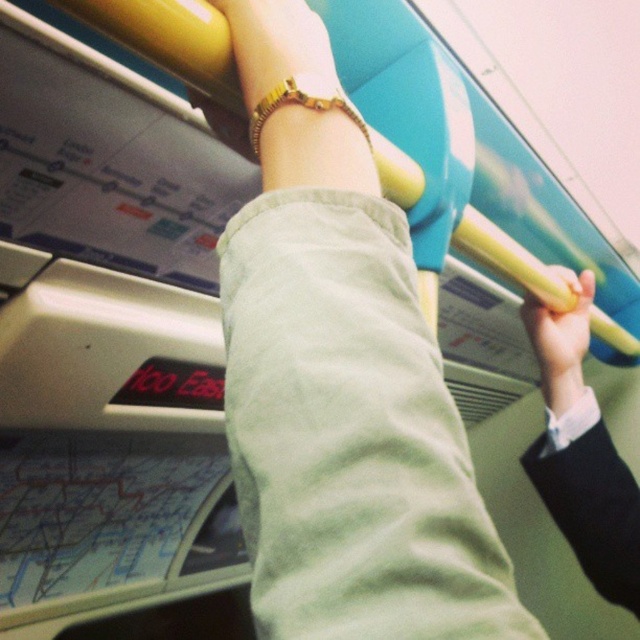
Is point (324, 40) behind point (564, 317)?

No, it is in front of (564, 317).

Who is positioned more to the left, light green cotton pants at center or yellow rubber grip at upper right?

From the viewer's perspective, light green cotton pants at center appears more on the left side.

Between point (323, 24) and point (572, 365), which one is positioned in front?

Point (323, 24) is more forward.

Where is `light green cotton pants at center`? Image resolution: width=640 pixels, height=640 pixels. light green cotton pants at center is located at coordinates (348, 412).

Can you confirm if yellow rubber grip at upper right is wider than gold textured bracelet at upper center?

Correct, the width of yellow rubber grip at upper right exceeds that of gold textured bracelet at upper center.

Does yellow rubber grip at upper right have a smaller size compared to gold textured bracelet at upper center?

No.

Is point (566, 353) behind point (256, 116)?

Yes, point (566, 353) is farther from viewer.

Image resolution: width=640 pixels, height=640 pixels. Find the location of `yellow rubber grip at upper right`. yellow rubber grip at upper right is located at coordinates (561, 332).

Which is behind, point (298, 568) or point (273, 100)?

Point (273, 100)

Is the position of light green cotton pants at center less distant than that of gold textured bracelet at upper center?

Yes, it is.

What do you see at coordinates (348, 412) in the screenshot? I see `light green cotton pants at center` at bounding box center [348, 412].

Where is `light green cotton pants at center`? light green cotton pants at center is located at coordinates (348, 412).